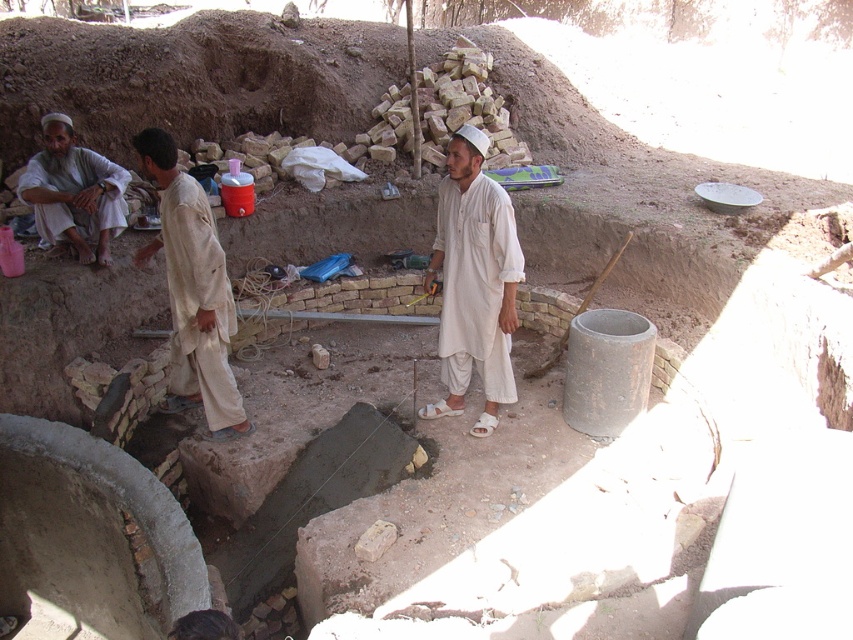
You are a tailor observing the clothing of two workers at a construction site. The workers are wearing the white cotton kameez at center and the white cotton shirt at left. Which garment has a narrower width?

The white cotton kameez at center is thinner than the white cotton shirt at left, so the white cotton kameez at center has a narrower width.

Based on the scene description, which of the two workers wearing the white cotton kameez at center and the light beige cotton shirt at center is standing to the right?

The white cotton kameez at center is positioned on the right side of the light beige cotton shirt at center, so the worker in the white cotton kameez at center is standing to the right of the light beige cotton shirt at center.

What is located at the coordinates point (192, 291)?

The light beige cotton shirt at center is located at point (192, 291).